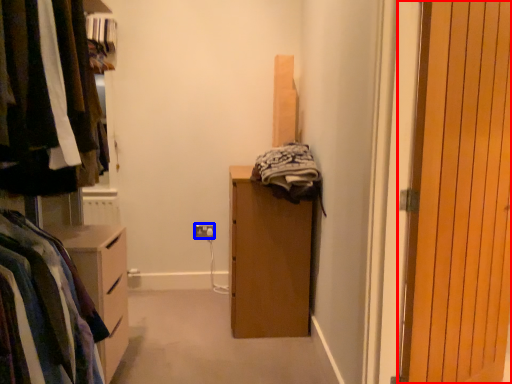
Question: Among these objects, which one is farthest to the camera, door (highlighted by a red box) or electric outlet (highlighted by a blue box)?

Choices:
 (A) door
 (B) electric outlet

Answer: (B)